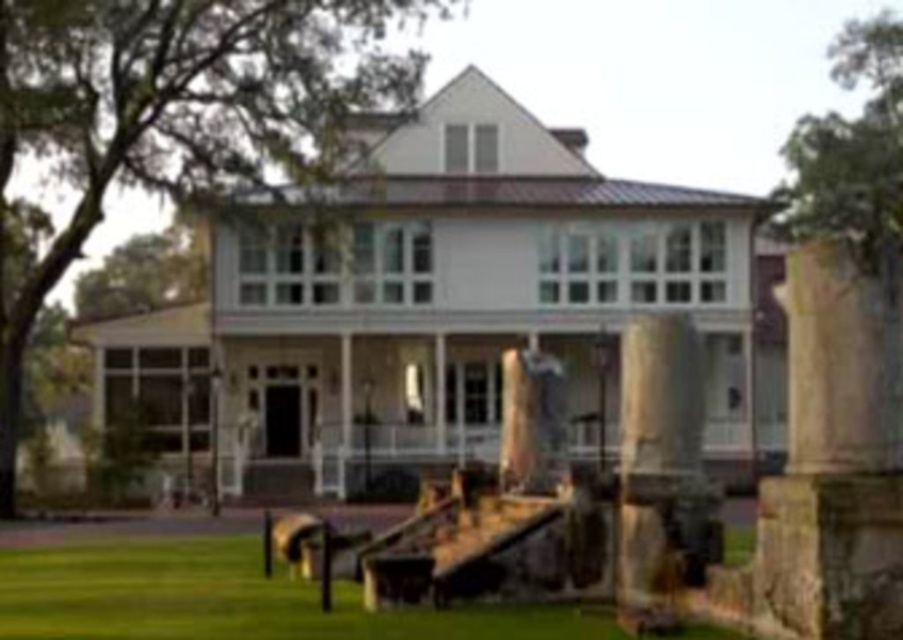
Can you confirm if green grass at lower left is positioned below brown stone pillar at center?

Indeed, green grass at lower left is positioned under brown stone pillar at center.

What do you see at coordinates (233, 598) in the screenshot?
I see `green grass at lower left` at bounding box center [233, 598].

Find the location of a particular element. This screenshot has width=903, height=640. green grass at lower left is located at coordinates (233, 598).

Is point (857, 284) behind point (271, 582)?

No, it is in front of (271, 582).

Which of these two, beige stone column at right or green grass at lower left, stands shorter?

green grass at lower left

Is point (790, 561) closer to viewer compared to point (504, 616)?

That is True.

In order to click on beige stone column at right in this screenshot , I will do `click(833, 464)`.

Is beige stone column at right closer to camera compared to brown stone pillar at center?

Yes, it is.

Is beige stone column at right positioned behind brown stone pillar at center?

That is False.

What are the coordinates of `beige stone column at right` in the screenshot? It's located at (833, 464).